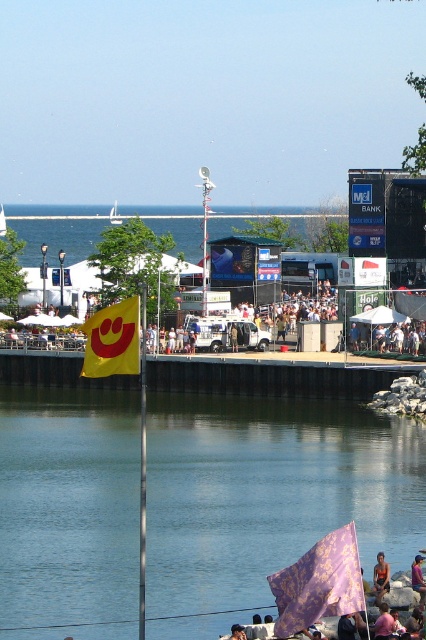
Question: Is transparent water at lower center above blue water at lower left?

Choices:
 (A) no
 (B) yes

Answer: (A)

Question: Does purple damask fabric at lower right appear under metallic blue scoreboard at upper right?

Choices:
 (A) yes
 (B) no

Answer: (A)

Question: Which object is closer to the camera taking this photo?

Choices:
 (A) transparent water at lower center
 (B) purple damask fabric at lower right
 (C) blue water at lower left
 (D) yellow fabric flag at center-left

Answer: (B)

Question: Does blue water at lower left appear on the right side of metallic blue scoreboard at upper right?

Choices:
 (A) no
 (B) yes

Answer: (A)

Question: Among these points, which one is farthest from the camera?

Choices:
 (A) (x=379, y=588)
 (B) (x=296, y=605)
 (C) (x=175, y=220)
 (D) (x=97, y=337)

Answer: (C)

Question: Which object appears closest to the camera in this image?

Choices:
 (A) orange fabric at lower right
 (B) blue water at lower left

Answer: (A)